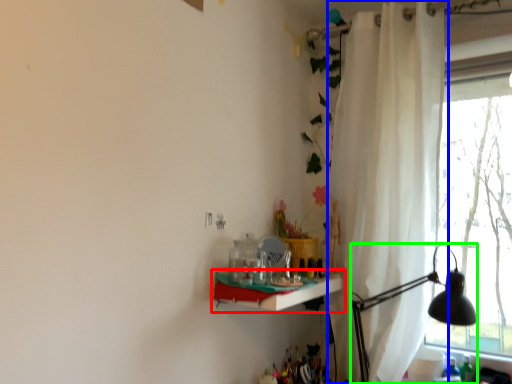
Question: Which object is positioned closest to shelf (highlighted by a red box)? Select from curtain (highlighted by a blue box) and table lamp (highlighted by a green box).

Choices:
 (A) curtain
 (B) table lamp

Answer: (B)